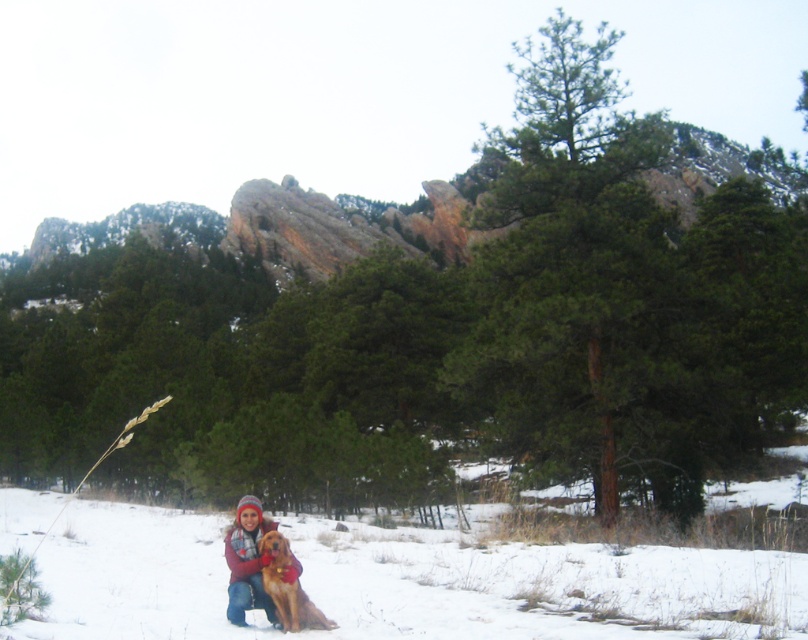
You are a photographer trying to capture the scene from the camera position. If you want to get closer to the white fluffy snow at lower center by 2 meters, how far will you be from it?

The camera is currently 6.47 meters away from the white fluffy snow at lower center. If you move 2 meters closer, you will be 4.47 meters away from it.

You are a photographer planning to take a photo of the scene described. The camera you are using has a sensor that can only capture objects within a circular area with a radius of 0.4 units centered at point 0.5, 0.5. Will the white fluffy snow at lower center be captured in your photo?

The white fluffy snow at lower center is located at point (x=404, y=582). The distance from the center of the sensor area at (x=404, y=320) to this point is sqrt of squared difference in x coordinates plus squared difference in y coordinates. The x difference is 0.911 minus 0.5 equals 0.411, y difference is 0.500 minus 0.5 equals 0.0. Squared differences are 0.169 and 0.0, sum is 0.169. Square root of 0.169 is approximately 0.411, which is less than the radius of 0.4. Wait, 0.411 is greater than 0.4. Therefore, the

Based on the photo, what is the exact coordinate of the white fluffy snow at lower center?

The white fluffy snow at lower center is located at point (404, 582).